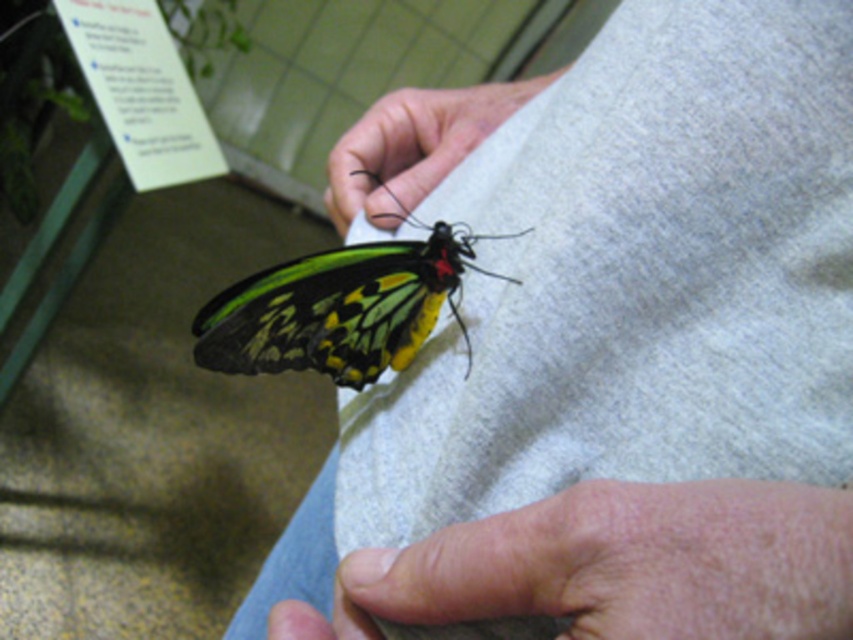
Question: Estimate the real-world distances between objects in this image. Which object is farther from the matte black butterfly at center?

Choices:
 (A) dry skin at lower center
 (B) shiny metallic butterfly at center

Answer: (A)

Question: Does shiny metallic butterfly at center have a greater width compared to matte black butterfly at center?

Choices:
 (A) yes
 (B) no

Answer: (B)

Question: Which of the following is the closest to the observer?

Choices:
 (A) dry skin at lower center
 (B) shiny metallic butterfly at center
 (C) matte black butterfly at center

Answer: (A)

Question: Does shiny metallic butterfly at center have a lesser width compared to matte black butterfly at center?

Choices:
 (A) yes
 (B) no

Answer: (A)

Question: Does shiny metallic butterfly at center have a larger size compared to matte black butterfly at center?

Choices:
 (A) no
 (B) yes

Answer: (B)

Question: Which point is farther to the camera?

Choices:
 (A) dry skin at lower center
 (B) shiny metallic butterfly at center

Answer: (B)